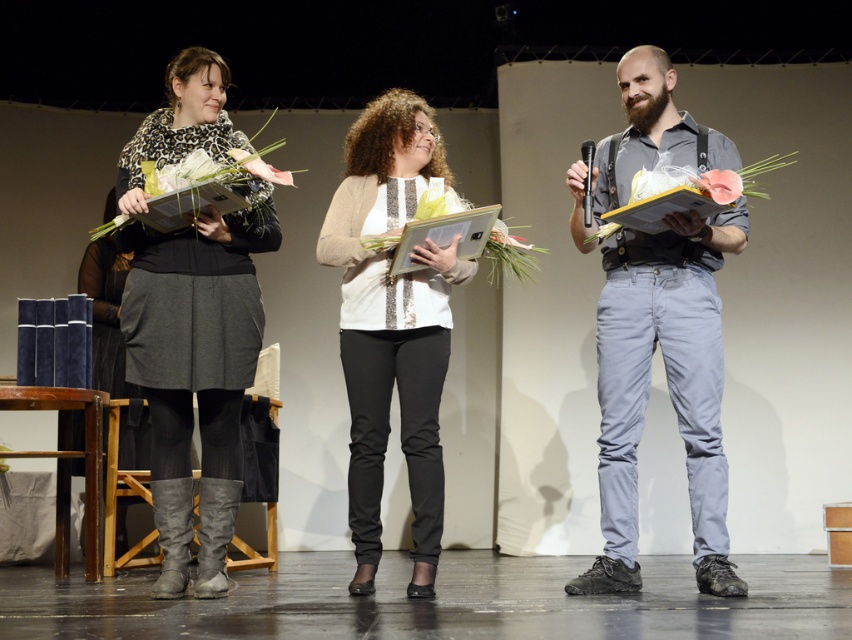
You are a photographer standing at the back of the stage. You want to take a photo of the white sequined blouse at center and the matte white flower at center. How far apart are these two items in feet?

The white sequined blouse at center is 3.92 feet away from the matte white flower at center.

You are an event photographer who needs to ensure all elements are properly framed in your shot. Given the white sequined blouse at center and the matte white flower at center, which one should you focus on first to ensure it doesn not get obscured?

The white sequined blouse at center is larger in size than the matte white flower at center, so you should focus on the white sequined blouse at center first to ensure it does not obscure the smaller matte white flower at center.

You are a photographer adjusting your camera settings to focus on two specific points in the image. The first point is point [185,77] and the second is point [721,188]. Which point should you focus on first if you want to ensure both are in focus, starting from the closest one to the camera?

You should focus on point [185,77] first because it is closer to the camera than point [721,188]. After focusing on the closer point, you can adjust to ensure the farther point is also in focus.